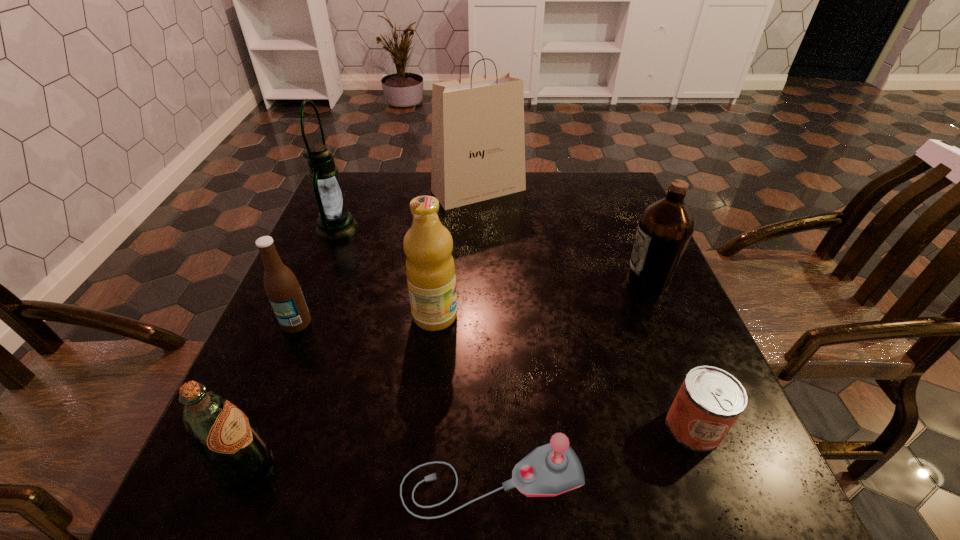
What are the coordinates of `shopping bag that is at the far edge` in the screenshot? It's located at (478, 141).

Locate an element on the screen. The image size is (960, 540). lantern located in the far edge section of the desktop is located at coordinates (335, 221).

Find the location of a particular element. olive oil that is at the near edge is located at coordinates (233, 451).

At what (x,y) coordinates should I click in order to perform the action: click on joystick that is at the near edge. Please return your answer as a coordinate pair (x, y). Image resolution: width=960 pixels, height=540 pixels. Looking at the image, I should click on (552, 469).

The image size is (960, 540). In order to click on lantern located in the left edge section of the desktop in this screenshot , I will do `click(335, 221)`.

Where is `beer bottle that is at the left edge`? The image size is (960, 540). beer bottle that is at the left edge is located at coordinates (282, 288).

Where is `olive oil located at the left edge`? This screenshot has height=540, width=960. olive oil located at the left edge is located at coordinates (233, 451).

What are the coordinates of `olive oil at the right edge` in the screenshot? It's located at (665, 228).

Identify the location of can located at the right edge. (709, 401).

Where is `object at the far left corner`? object at the far left corner is located at coordinates (335, 221).